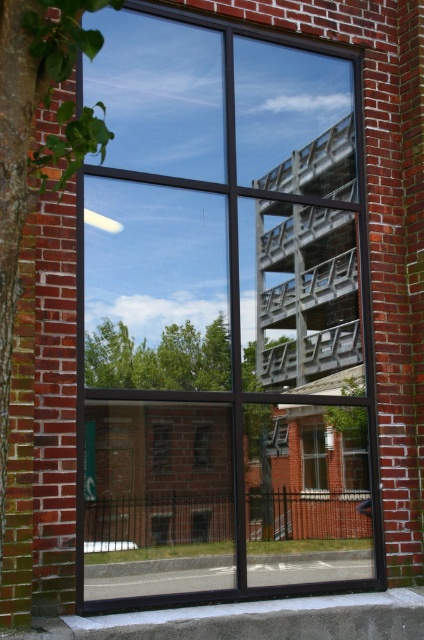
Can you confirm if black glass window at center is positioned to the left of clear glass window at center?

Indeed, black glass window at center is positioned on the left side of clear glass window at center.

Based on the photo, is black glass window at center above clear glass window at center?

Indeed, black glass window at center is positioned over clear glass window at center.

Is point (113, 497) more distant than point (301, 438)?

No, (113, 497) is in front of (301, 438).

At what (x,y) coordinates should I click in order to perform the action: click on black glass window at center. Please return your answer as a coordinate pair (x, y). The width and height of the screenshot is (424, 640). Looking at the image, I should click on (220, 314).

Does black glass window at center have a larger size compared to green leafy tree at left?

Indeed, black glass window at center has a larger size compared to green leafy tree at left.

Between black glass window at center and green leafy tree at left, which one appears on the left side from the viewer's perspective?

Positioned to the left is green leafy tree at left.

Identify the location of black glass window at center. (220, 314).

Who is shorter, green leafy tree at left or clear glass window at center?

clear glass window at center is shorter.

The height and width of the screenshot is (640, 424). What are the coordinates of `green leafy tree at left` in the screenshot? It's located at (36, 145).